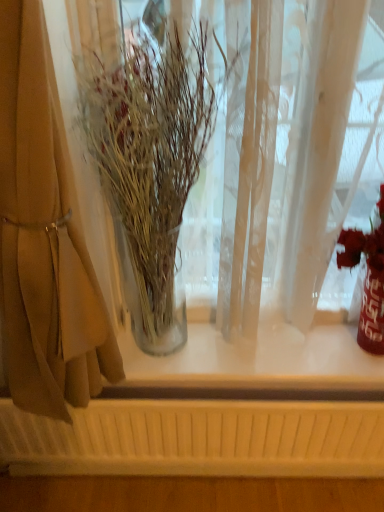
Question: Is shiny metallic vase at right in front of or behind beige fabric curtain at left in the image?

Choices:
 (A) front
 (B) behind

Answer: (B)

Question: Do you think shiny metallic vase at right is within beige fabric curtain at left, or outside of it?

Choices:
 (A) inside
 (B) outside

Answer: (B)

Question: Which is nearer to the shiny metallic vase at right?

Choices:
 (A) beige fabric curtain at left
 (B) clear glass vase at left

Answer: (B)

Question: Estimate the real-world distances between objects in this image. Which object is farther from the beige fabric curtain at left?

Choices:
 (A) clear glass vase at left
 (B) shiny metallic vase at right

Answer: (B)